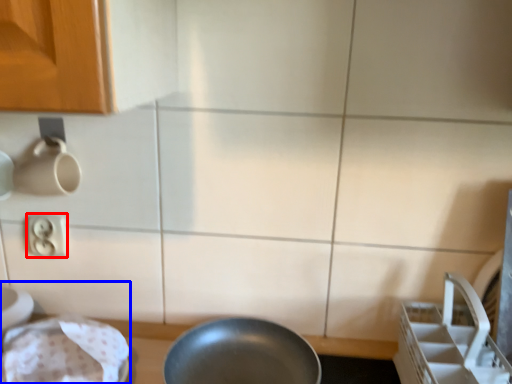
Question: Which point is closer to the camera, electric outlet (highlighted by a red box) or sink (highlighted by a blue box)?

Choices:
 (A) electric outlet
 (B) sink

Answer: (B)